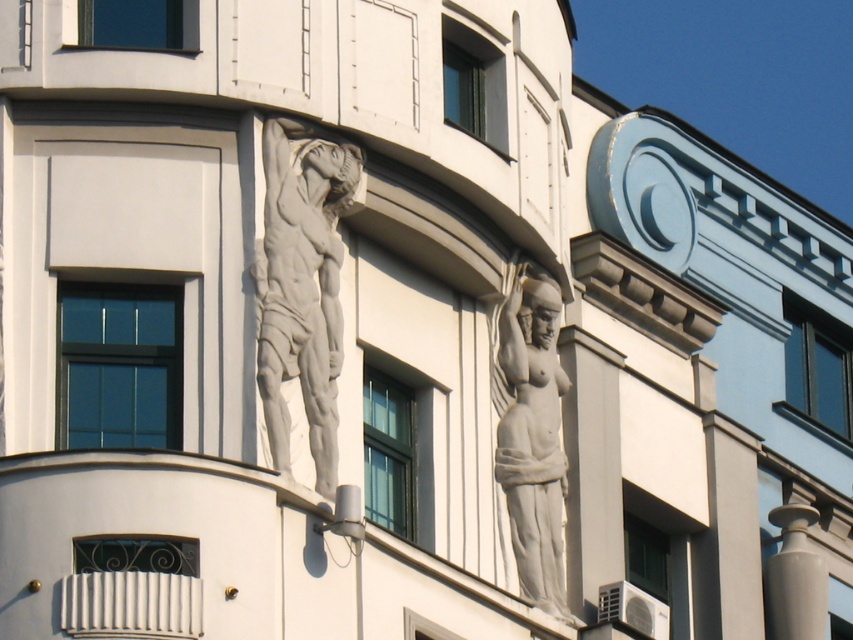
Question: Can you confirm if white marble statue at center is wider than white glossy pillar at lower right?

Choices:
 (A) no
 (B) yes

Answer: (A)

Question: Which point is closer to the camera?

Choices:
 (A) white stone sculpture at upper center
 (B) white glossy pillar at lower right
 (C) white marble statue at center

Answer: (A)

Question: Which of the following is the farthest from the observer?

Choices:
 (A) (778, 596)
 (B) (335, 340)
 (C) (520, 492)

Answer: (A)

Question: Is white stone sculpture at upper center bigger than white glossy pillar at lower right?

Choices:
 (A) no
 (B) yes

Answer: (B)

Question: Which is nearer to the white glossy pillar at lower right?

Choices:
 (A) white marble statue at center
 (B) white stone sculpture at upper center

Answer: (A)

Question: Is white stone sculpture at upper center wider than white glossy pillar at lower right?

Choices:
 (A) yes
 (B) no

Answer: (A)